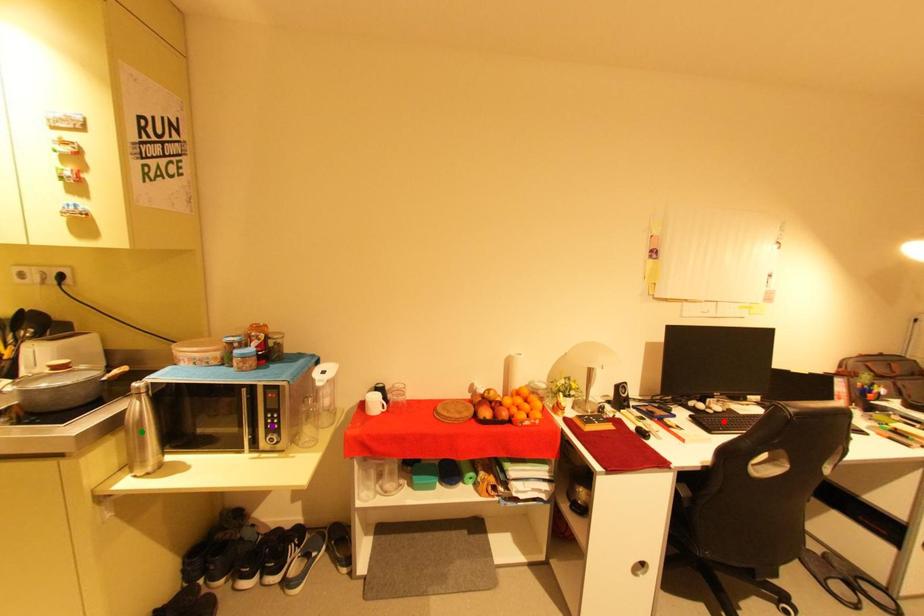
Order these from nearest to farthest:
- purple point
- red point
- green point

green point < purple point < red point